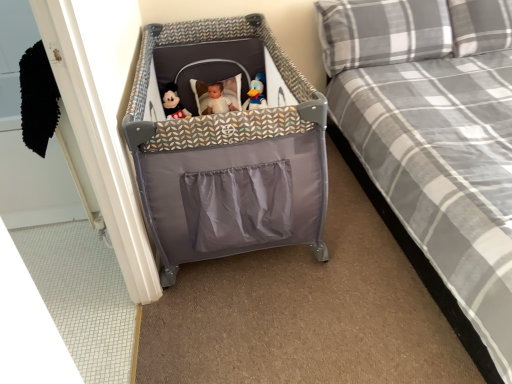
Question: From the image's perspective, is gray plaid pillow at upper right, which is the second pillow in right-to-left order, under blue plush duck at center?

Choices:
 (A) no
 (B) yes

Answer: (A)

Question: Can you confirm if gray plaid pillow at upper right, marked as the first pillow in a left-to-right arrangement, is bigger than blue plush duck at center?

Choices:
 (A) yes
 (B) no

Answer: (A)

Question: Is gray plaid pillow at upper right, marked as the first pillow in a left-to-right arrangement, not inside blue plush duck at center?

Choices:
 (A) no
 (B) yes

Answer: (B)

Question: From the image's perspective, is gray plaid pillow at upper right, marked as the first pillow in a left-to-right arrangement, located above blue plush duck at center?

Choices:
 (A) no
 (B) yes

Answer: (B)

Question: Is gray plaid pillow at upper right, which is the second pillow in right-to-left order, closer to camera compared to blue plush duck at center?

Choices:
 (A) no
 (B) yes

Answer: (B)

Question: Does gray plaid pillow at upper right, which is the second pillow in right-to-left order, come behind blue plush duck at center?

Choices:
 (A) yes
 (B) no

Answer: (B)

Question: From a real-world perspective, is matte plush mickey mouse at center located higher than gray plaid pillow at upper right, marked as the first pillow in a left-to-right arrangement?

Choices:
 (A) no
 (B) yes

Answer: (A)

Question: Is matte plush mickey mouse at center shorter than gray plaid pillow at upper right, marked as the first pillow in a left-to-right arrangement?

Choices:
 (A) no
 (B) yes

Answer: (B)

Question: Is matte plush mickey mouse at center facing towards gray plaid pillow at upper right, marked as the first pillow in a left-to-right arrangement?

Choices:
 (A) no
 (B) yes

Answer: (A)

Question: Considering the relative sizes of matte plush mickey mouse at center and gray plaid pillow at upper right, marked as the first pillow in a left-to-right arrangement, in the image provided, is matte plush mickey mouse at center wider than gray plaid pillow at upper right, marked as the first pillow in a left-to-right arrangement,?

Choices:
 (A) yes
 (B) no

Answer: (B)

Question: Considering the relative sizes of matte plush mickey mouse at center and gray plaid pillow at upper right, marked as the first pillow in a left-to-right arrangement, in the image provided, is matte plush mickey mouse at center bigger than gray plaid pillow at upper right, marked as the first pillow in a left-to-right arrangement,?

Choices:
 (A) no
 (B) yes

Answer: (A)

Question: Considering the relative sizes of matte plush mickey mouse at center and gray plaid pillow at upper right, which is the second pillow in right-to-left order, in the image provided, is matte plush mickey mouse at center taller than gray plaid pillow at upper right, which is the second pillow in right-to-left order,?

Choices:
 (A) yes
 (B) no

Answer: (B)

Question: Is plaid fabric bed at center not inside matte plush mickey mouse at center?

Choices:
 (A) no
 (B) yes

Answer: (B)